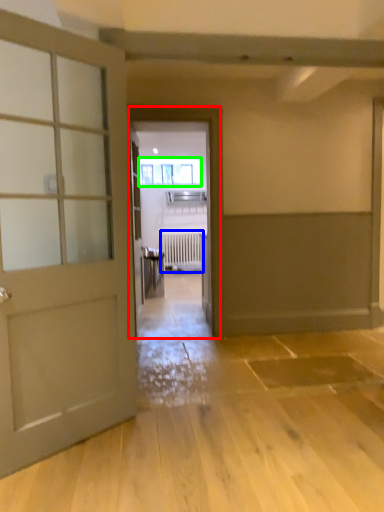
Question: Based on their relative distances, which object is nearer to elevator (highlighted by a red box)? Choose from radiator (highlighted by a blue box) and window (highlighted by a green box).

Choices:
 (A) radiator
 (B) window

Answer: (A)